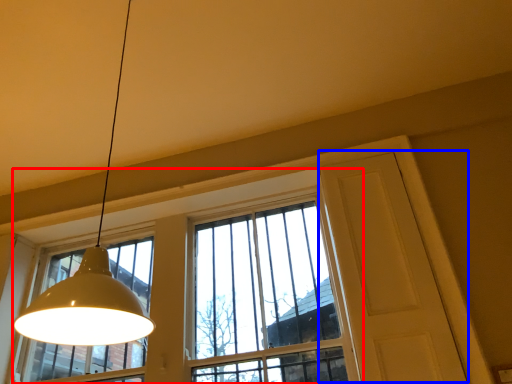
Question: Which object appears farthest to the camera in this image, window (highlighted by a red box) or screen door (highlighted by a blue box)?

Choices:
 (A) window
 (B) screen door

Answer: (A)